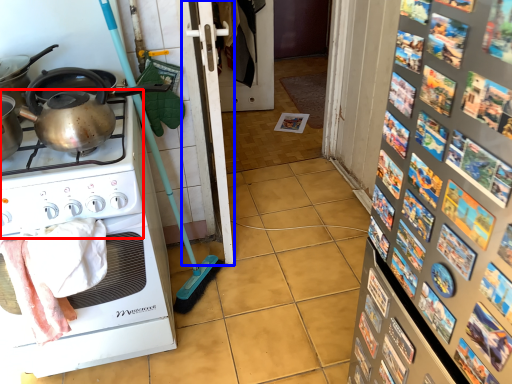
Question: Which object is closer to the camera taking this photo, gas stove (highlighted by a red box) or screen door (highlighted by a blue box)?

Choices:
 (A) gas stove
 (B) screen door

Answer: (A)